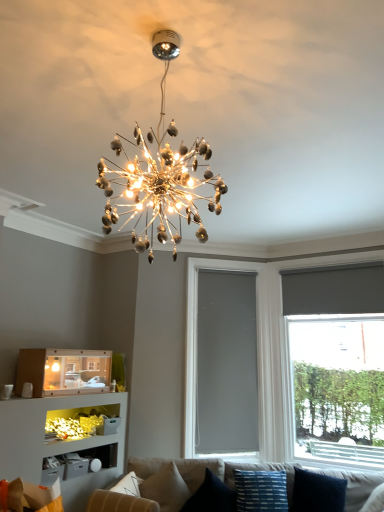
The image size is (384, 512). Describe the element at coordinates (211, 496) in the screenshot. I see `velvet blue pillow at lower center, the third pillow from the right` at that location.

Locate an element on the screen. The image size is (384, 512). gray matte window screen at center is located at coordinates (226, 362).

What do you see at coordinates (226, 362) in the screenshot? I see `gray matte window screen at center` at bounding box center [226, 362].

Measure the distance between dark blue fabric pillow at lower right, which is the fourth pillow from left to right, and camera.

dark blue fabric pillow at lower right, which is the fourth pillow from left to right, is 3.56 meters from camera.

The image size is (384, 512). What do you see at coordinates (317, 492) in the screenshot? I see `dark blue fabric pillow at lower right, which is the fourth pillow from left to right` at bounding box center [317, 492].

What do you see at coordinates (228, 472) in the screenshot? The image size is (384, 512). I see `beige fabric couch at lower center` at bounding box center [228, 472].

Based on the photo, what is the approximate width of beige fabric pillow at lower center, positioned as the first pillow in left-to-right order?

The width of beige fabric pillow at lower center, positioned as the first pillow in left-to-right order, is 13.86 inches.

This screenshot has width=384, height=512. Find the location of `blue striped fabric pillow at lower center, which is counted as the 3th pillow, starting from the left`. blue striped fabric pillow at lower center, which is counted as the 3th pillow, starting from the left is located at coordinates (261, 490).

At what (x,y) coordinates should I click in order to perform the action: click on velvet blue pillow at lower center, which appears as the 2th pillow when viewed from the left. Please return your answer as a coordinate pair (x, y). This screenshot has height=512, width=384. Looking at the image, I should click on (211, 496).

Image resolution: width=384 pixels, height=512 pixels. Find the location of `lamp above the matte gray roller shade at right (from the image's perspective)`. lamp above the matte gray roller shade at right (from the image's perspective) is located at coordinates (159, 175).

Considering the positions of objects matte gray roller shade at right and shiny metallic chandelier at center in the image provided, who is more to the left, matte gray roller shade at right or shiny metallic chandelier at center?

shiny metallic chandelier at center.

From the picture: From the image's perspective, is matte gray roller shade at right on shiny metallic chandelier at center?

No, from the image's perspective, matte gray roller shade at right is not above shiny metallic chandelier at center.

Would you say matte gray roller shade at right is a long distance from shiny metallic chandelier at center?

That's right, there is a large distance between matte gray roller shade at right and shiny metallic chandelier at center.

Looking at this image, in the image, is shiny metallic chandelier at center positioned in front of or behind matte gray roller shade at right?

In the image, shiny metallic chandelier at center appears in front of matte gray roller shade at right.

Is shiny metallic chandelier at center facing towards matte gray roller shade at right?

No, shiny metallic chandelier at center is not oriented towards matte gray roller shade at right.

Based on the photo, which object is positioned more to the left, shiny metallic chandelier at center or matte gray roller shade at right?

From the viewer's perspective, shiny metallic chandelier at center appears more on the left side.

Which of these two, gray matte window screen at center or beige fabric couch at lower center, is thinner?

gray matte window screen at center is thinner.

Is point (250, 435) closer or farther from the camera than point (95, 507)?

Clearly, point (250, 435) is more distant from the camera than point (95, 507).

Is gray matte window screen at center oriented away from beige fabric couch at lower center?

No, gray matte window screen at center's orientation is not away from beige fabric couch at lower center.

Is gray matte window screen at center at the left side of beige fabric couch at lower center?

In fact, gray matte window screen at center is to the right of beige fabric couch at lower center.

Would you say blue striped fabric pillow at lower center, which is counted as the 3th pillow, starting from the left, is inside or outside beige fabric pillow at lower center, the 4th pillow from the right?

blue striped fabric pillow at lower center, which is counted as the 3th pillow, starting from the left, exists outside the volume of beige fabric pillow at lower center, the 4th pillow from the right.

Find the location of a particular element. the 2nd pillow to the left when counting from the blue striped fabric pillow at lower center, the second pillow viewed from the right is located at coordinates (166, 488).

From a real-world perspective, is blue striped fabric pillow at lower center, the second pillow viewed from the right, below beige fabric pillow at lower center, positioned as the first pillow in left-to-right order?

Incorrect, from a real-world perspective, blue striped fabric pillow at lower center, the second pillow viewed from the right, is higher than beige fabric pillow at lower center, positioned as the first pillow in left-to-right order.

Is point (234, 477) closer or farther from the camera than point (167, 492)?

Point (234, 477) appears to be farther away from the viewer than point (167, 492).

What's the angular difference between gray matte window screen at center and matte cardboard shelf at lower left's facing directions?

They differ by 43.8 degrees in their facing directions.

Is gray matte window screen at center positioned beyond the bounds of matte cardboard shelf at lower left?

Yes, gray matte window screen at center is outside of matte cardboard shelf at lower left.

Considering the positions of objects gray matte window screen at center and matte cardboard shelf at lower left in the image provided, who is more to the right, gray matte window screen at center or matte cardboard shelf at lower left?

gray matte window screen at center is more to the right.

Is gray matte window screen at center bigger or smaller than matte cardboard shelf at lower left?

Considering their sizes, gray matte window screen at center takes up more space than matte cardboard shelf at lower left.

Is shiny metallic chandelier at center not close to beige fabric pillow at lower center, positioned as the first pillow in left-to-right order?

shiny metallic chandelier at center is positioned a significant distance from beige fabric pillow at lower center, positioned as the first pillow in left-to-right order.

Is shiny metallic chandelier at center outside of beige fabric pillow at lower center, the 4th pillow from the right?

Yes, shiny metallic chandelier at center is not within beige fabric pillow at lower center, the 4th pillow from the right.

Can you confirm if shiny metallic chandelier at center is bigger than beige fabric pillow at lower center, positioned as the first pillow in left-to-right order?

Indeed, shiny metallic chandelier at center has a larger size compared to beige fabric pillow at lower center, positioned as the first pillow in left-to-right order.

Are matte cardboard shelf at lower left and beige fabric couch at lower center located far from each other?

Absolutely, matte cardboard shelf at lower left is distant from beige fabric couch at lower center.

Is beige fabric couch at lower center at the back of matte cardboard shelf at lower left?

No, matte cardboard shelf at lower left's orientation is not away from beige fabric couch at lower center.

From a real-world perspective, is matte cardboard shelf at lower left positioned above or below beige fabric couch at lower center?

From a real-world perspective, matte cardboard shelf at lower left is physically above beige fabric couch at lower center.

Find the location of `lamp that appears on the left of matte gray roller shade at right`. lamp that appears on the left of matte gray roller shade at right is located at coordinates (159, 175).

The width and height of the screenshot is (384, 512). I want to click on window behind the shiny metallic chandelier at center, so click(337, 361).

Estimate the real-world distances between objects in this image. Which object is further from gray matte window screen at center, beige fabric pillow at lower center, positioned as the first pillow in left-to-right order, or beige fabric couch at lower center?

Among the two, beige fabric pillow at lower center, positioned as the first pillow in left-to-right order, is located further to gray matte window screen at center.

From the image, which object appears to be farther from matte gray roller shade at right, gray matte window screen at center or beige fabric pillow at lower center, positioned as the first pillow in left-to-right order?

Among the two, beige fabric pillow at lower center, positioned as the first pillow in left-to-right order, is located further to matte gray roller shade at right.

Considering their positions, is blue striped fabric pillow at lower center, the second pillow viewed from the right, positioned further to matte gray roller shade at right than dark blue fabric pillow at lower right, the 1th pillow when ordered from right to left?

blue striped fabric pillow at lower center, the second pillow viewed from the right.

Which object lies nearer to the anchor point velvet blue pillow at lower center, which appears as the 2th pillow when viewed from the left, matte gray roller shade at right or blue striped fabric pillow at lower center, the second pillow viewed from the right?

Based on the image, blue striped fabric pillow at lower center, the second pillow viewed from the right, appears to be nearer to velvet blue pillow at lower center, which appears as the 2th pillow when viewed from the left.

Which object lies further to the anchor point dark blue fabric pillow at lower right, the 1th pillow when ordered from right to left, matte cardboard shelf at lower left or beige fabric couch at lower center?

matte cardboard shelf at lower left lies further to dark blue fabric pillow at lower right, the 1th pillow when ordered from right to left, than the other object.

Looking at the image, which one is located further to matte cardboard shelf at lower left, beige fabric couch at lower center or dark blue fabric pillow at lower right, which is the fourth pillow from left to right?

Based on the image, dark blue fabric pillow at lower right, which is the fourth pillow from left to right, appears to be further to matte cardboard shelf at lower left.

When comparing their distances from shiny metallic chandelier at center, does gray matte window screen at center or dark blue fabric pillow at lower right, the 1th pillow when ordered from right to left, seem further?

dark blue fabric pillow at lower right, the 1th pillow when ordered from right to left, lies further to shiny metallic chandelier at center than the other object.

From the image, which object appears to be nearer to matte gray roller shade at right, velvet blue pillow at lower center, the third pillow from the right, or beige fabric couch at lower center?

Among the two, beige fabric couch at lower center is located nearer to matte gray roller shade at right.

What are the coordinates of `studio couch between matte cardboard shelf at lower left and gray matte window screen at center in the horizontal direction` in the screenshot? It's located at (228, 472).

At what (x,y) coordinates should I click in order to perform the action: click on studio couch between beige fabric pillow at lower center, positioned as the first pillow in left-to-right order, and blue striped fabric pillow at lower center, the second pillow viewed from the right, from left to right. Please return your answer as a coordinate pair (x, y). This screenshot has width=384, height=512. Looking at the image, I should click on click(x=228, y=472).

In order to click on studio couch situated between matte cardboard shelf at lower left and dark blue fabric pillow at lower right, the 1th pillow when ordered from right to left, from left to right in this screenshot , I will do `click(228, 472)`.

In order to click on window screen between matte cardboard shelf at lower left and matte gray roller shade at right in the horizontal direction in this screenshot , I will do `click(226, 362)`.